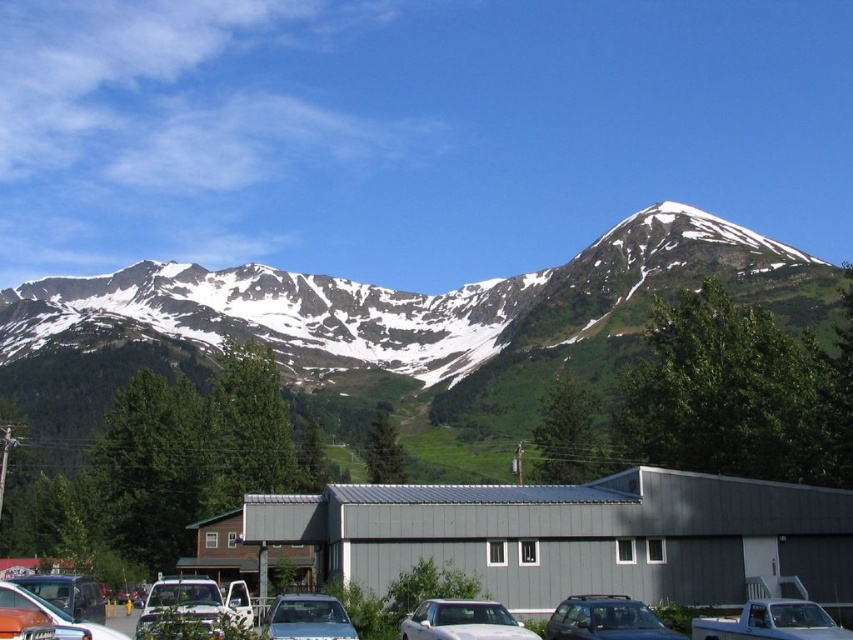
You are a photographer positioned in front of the modern building with a gray metal roof and walls. You want to capture both the metallic silver car at center and the white glossy sedan at center in your shot. Which car should you focus on first to ensure it appears closer in the photo?

You should focus on the metallic silver car at center first because it is closer to you than the white glossy sedan at center, making it appear closer in the photo.

You are a delivery driver who needs to park your truck, which is 2 meters tall, in the parking lot near the metallic silver cars at lower center and the metallic silver car at center. Based on their heights, which of these two cars would allow your truck to park without hitting the roof?

The metallic silver cars at lower center is much taller than the metallic silver car at center. Since your truck is 2 meters tall, you can park it near the metallic silver car at center without hitting the roof, as it is shorter than the truck.